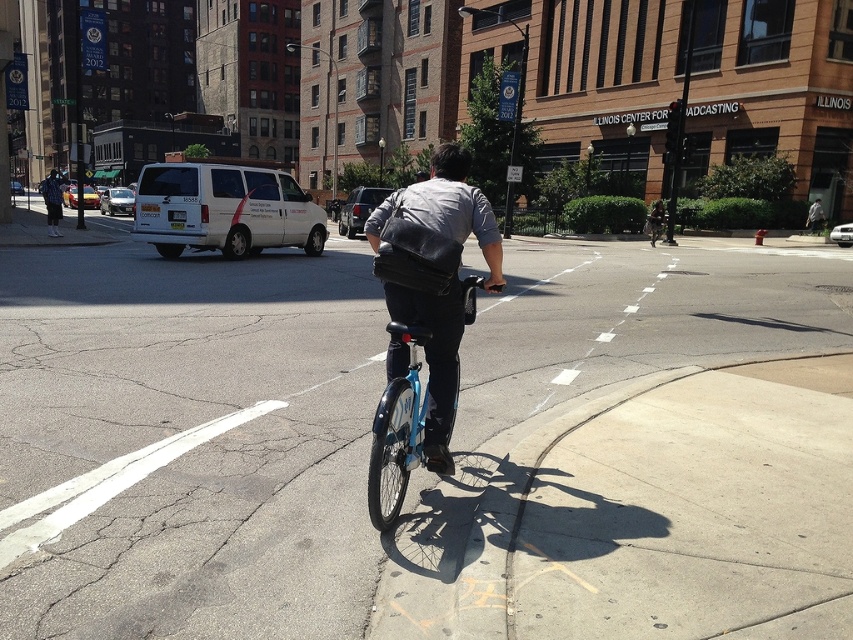
Question: Which of the following is the farthest from the observer?

Choices:
 (A) white matte van at left
 (B) matte black bicycle at center
 (C) blue metallic bicycle at center

Answer: (B)

Question: Does white matte van at left appear over matte black bicycle at center?

Choices:
 (A) no
 (B) yes

Answer: (A)

Question: Does white matte van at left appear on the right side of matte black bicycle at center?

Choices:
 (A) no
 (B) yes

Answer: (A)

Question: Is white matte van at left smaller than matte black bicycle at center?

Choices:
 (A) no
 (B) yes

Answer: (A)

Question: Which object is positioned farthest from the white matte van at left?

Choices:
 (A) matte black bicycle at center
 (B) blue metallic bicycle at center

Answer: (A)

Question: Which point appears farthest from the camera in this image?

Choices:
 (A) (662, 211)
 (B) (286, 237)
 (C) (402, 456)

Answer: (A)